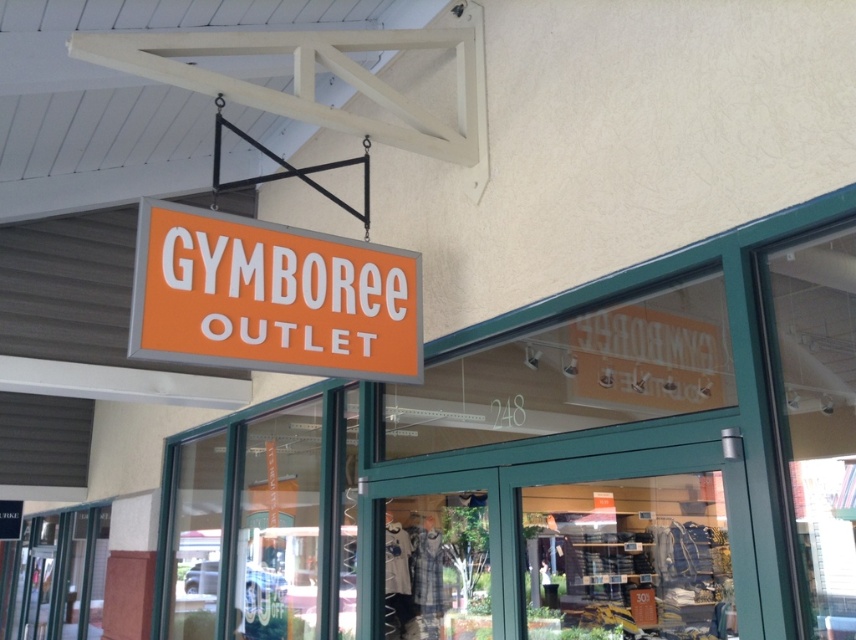
Question: Which of the following is the farthest from the observer?

Choices:
 (A) transparent glass door at center
 (B) orange matte sign at upper center

Answer: (A)

Question: Which object appears closest to the camera in this image?

Choices:
 (A) orange matte sign at upper center
 (B) transparent glass door at center

Answer: (A)

Question: Is orange matte sign at upper center positioned before transparent glass door at center?

Choices:
 (A) yes
 (B) no

Answer: (A)

Question: Which object appears closest to the camera in this image?

Choices:
 (A) orange matte sign at upper center
 (B) transparent glass door at center

Answer: (A)

Question: Is orange matte sign at upper center bigger than transparent glass door at center?

Choices:
 (A) no
 (B) yes

Answer: (A)

Question: Is the position of orange matte sign at upper center more distant than that of transparent glass door at center?

Choices:
 (A) yes
 (B) no

Answer: (B)